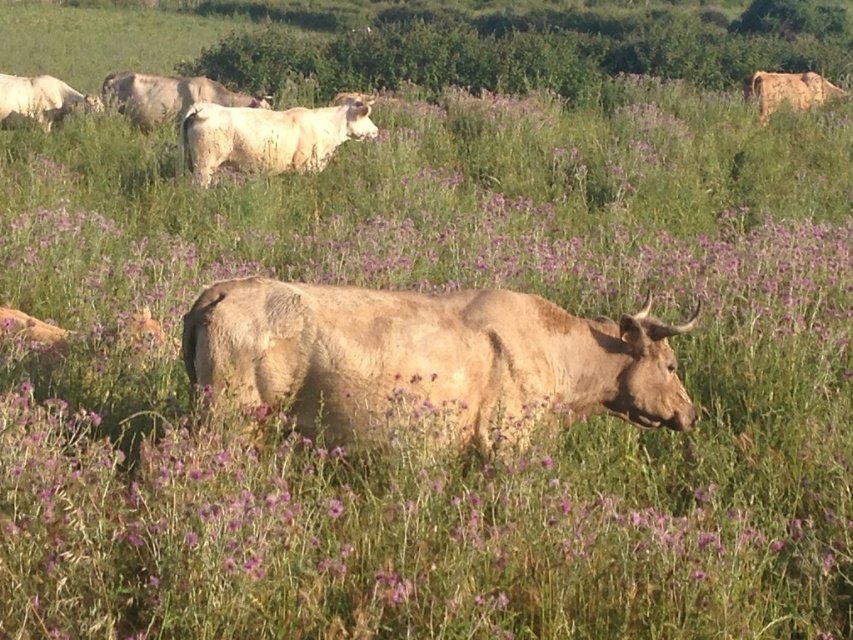
Is light brown cow at upper center positioned in front of light brown textured cow at upper right?

That is True.

What do you see at coordinates (167, 96) in the screenshot? I see `light brown cow at upper center` at bounding box center [167, 96].

What are the coordinates of `light brown cow at upper center` in the screenshot? It's located at (167, 96).

Is light brown textured bull at center further to camera compared to light brown cow at upper center?

No, light brown textured bull at center is in front of light brown cow at upper center.

Which is in front, point (506, 358) or point (160, 90)?

Point (506, 358) is more forward.

You are a GUI agent. You are given a task and a screenshot of the screen. Output one action in this format:
    pyautogui.click(x=<x>, y=<y>)
    Task: Click on the light brown textured bull at center
    This screenshot has width=853, height=640.
    Given the screenshot: What is the action you would take?
    pyautogui.click(x=428, y=356)

Who is more forward, (489, 296) or (822, 92)?

Positioned in front is point (489, 296).

Consider the image. Is light brown textured bull at center to the left of light brown textured cow at upper right from the viewer's perspective?

Indeed, light brown textured bull at center is positioned on the left side of light brown textured cow at upper right.

This screenshot has width=853, height=640. Identify the location of light brown textured bull at center. (428, 356).

What are the coordinates of `light brown textured bull at center` in the screenshot? It's located at (428, 356).